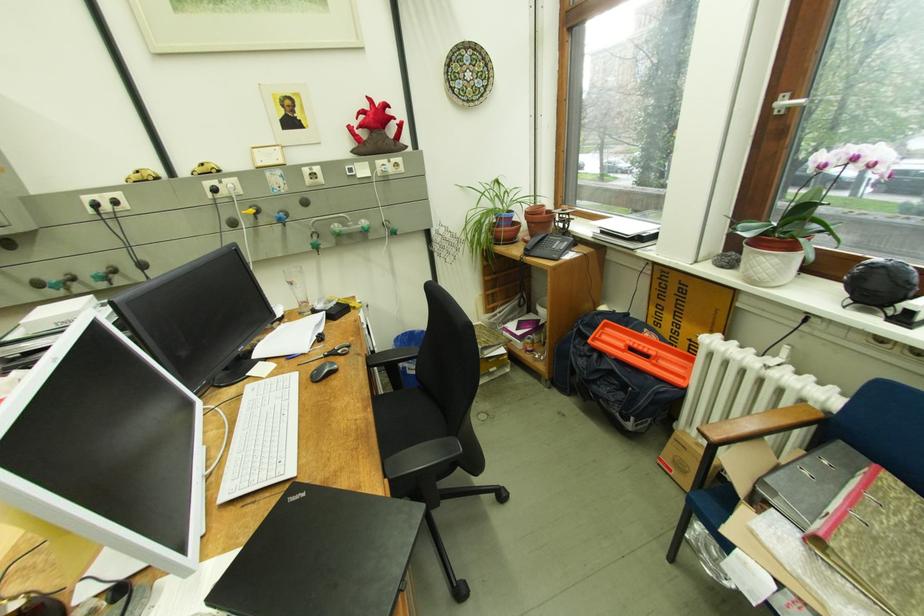
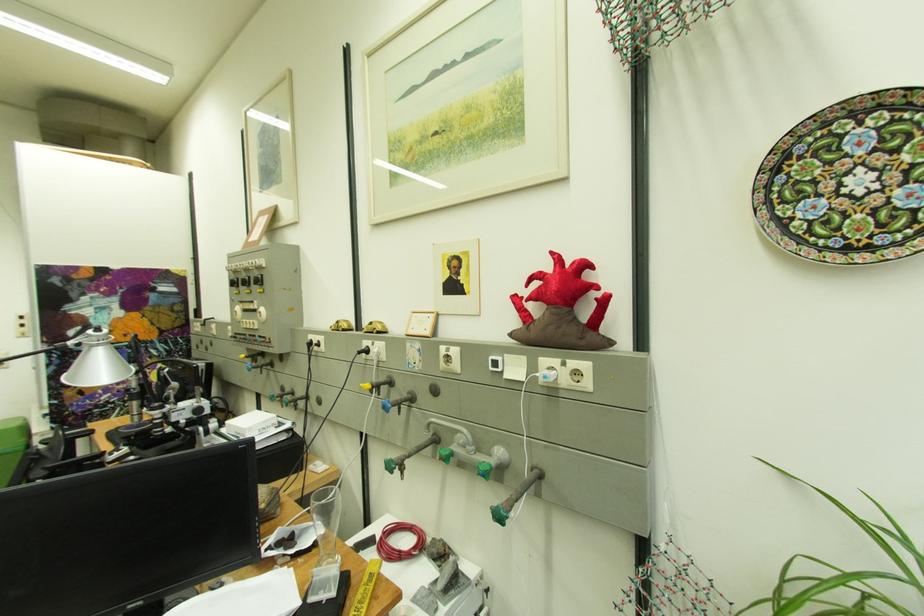
In the second image, find the point that corresponds to (x=377, y=108) in the first image.

(560, 267)